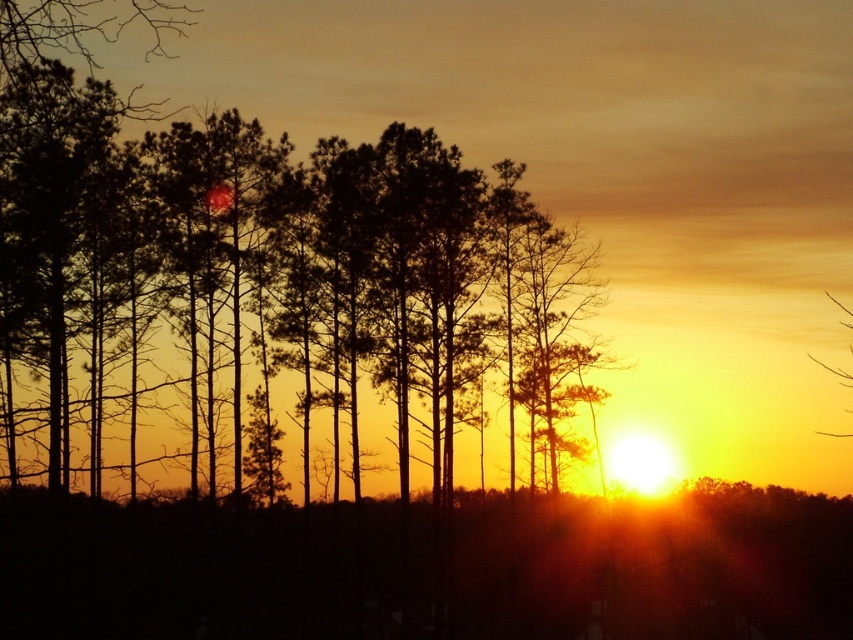
Question: Is silhouette tree at center above translucent yellow sky at upper right?

Choices:
 (A) yes
 (B) no

Answer: (A)

Question: Can you confirm if silhouette tree at center is positioned below translucent yellow sky at upper right?

Choices:
 (A) no
 (B) yes

Answer: (A)

Question: Can you confirm if silhouette tree at center is positioned below translucent yellow sky at upper right?

Choices:
 (A) yes
 (B) no

Answer: (B)

Question: Which of the following is the closest to the observer?

Choices:
 (A) translucent yellow sky at upper right
 (B) silhouette tree at center

Answer: (B)